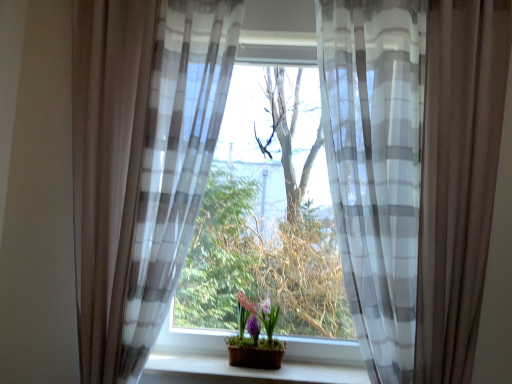
Question: Would you say wooden at center is inside or outside translucent fabric at center?

Choices:
 (A) outside
 (B) inside

Answer: (B)

Question: Considering the positions of wooden at center and translucent fabric at center in the image, is wooden at center wider or thinner than translucent fabric at center?

Choices:
 (A) wide
 (B) thin

Answer: (B)

Question: Estimate the real-world distances between objects in this image. Which object is closer to the sheer white and gray striped curtain at center, which is the first curtain in right-to-left order?

Choices:
 (A) sheer gray-white striped curtain at left, which appears as the second curtain when viewed from the right
 (B) translucent fabric at center
 (C) wooden at center
 (D) matte purple pot at center

Answer: (B)

Question: Considering the real-world distances, which object is closest to the wooden at center?

Choices:
 (A) translucent fabric at center
 (B) sheer white and gray striped curtain at center, marked as the 2th curtain in a left-to-right arrangement
 (C) matte purple pot at center
 (D) sheer gray-white striped curtain at left, which appears as the second curtain when viewed from the right

Answer: (C)